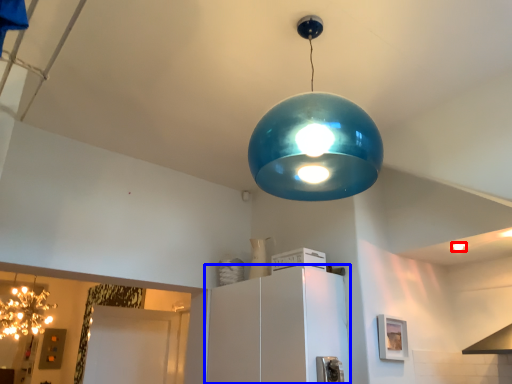
Question: Which of the following is the closest to the observer, light bulb (highlighted by a red box) or cabinetry (highlighted by a blue box)?

Choices:
 (A) light bulb
 (B) cabinetry

Answer: (B)